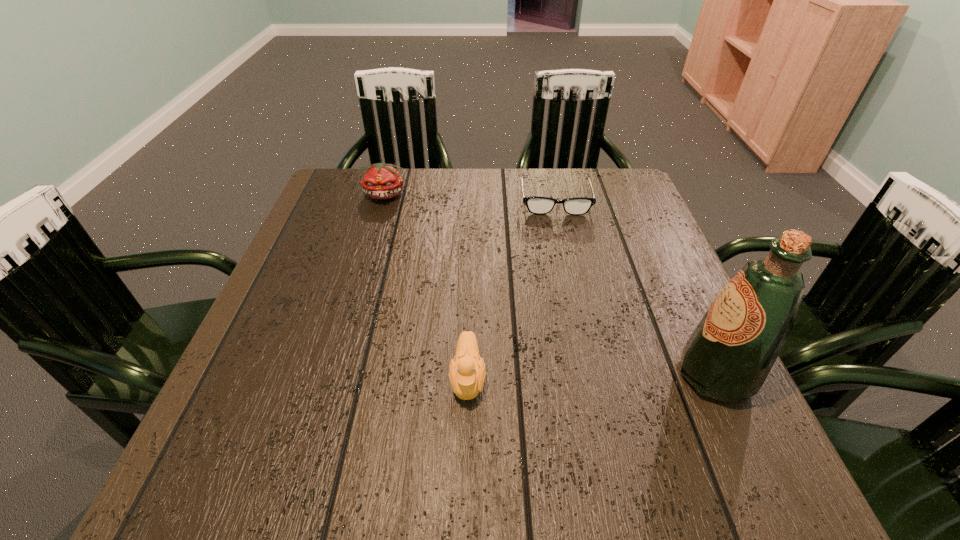
The width and height of the screenshot is (960, 540). I want to click on duckling, so click(x=467, y=374).

Find the location of a particular element. This screenshot has width=960, height=540. olive oil is located at coordinates (728, 357).

This screenshot has height=540, width=960. Find the location of `the tallest object`. the tallest object is located at coordinates (728, 357).

Locate an element on the screen. spectacles is located at coordinates (538, 205).

At what (x,y) coordinates should I click in order to perform the action: click on the shortest object. Please return your answer as a coordinate pair (x, y). The height and width of the screenshot is (540, 960). Looking at the image, I should click on (538, 205).

You are a GUI agent. You are given a task and a screenshot of the screen. Output one action in this format:
    pyautogui.click(x=<x>, y=<y>)
    Task: Click on the tomato
    
    Given the screenshot: What is the action you would take?
    pyautogui.click(x=381, y=181)

In order to click on blank space located 0.050m on the front-facing side of the rightmost object in this screenshot , I will do `click(651, 376)`.

Where is `free location located 0.280m on the front-facing side of the rightmost object`? The image size is (960, 540). free location located 0.280m on the front-facing side of the rightmost object is located at coordinates (524, 376).

Find the location of a particular element. The width and height of the screenshot is (960, 540). free space located on the front-facing side of the rightmost object is located at coordinates (496, 376).

You are a GUI agent. You are given a task and a screenshot of the screen. Output one action in this format:
    pyautogui.click(x=<x>, y=<y>)
    Task: Click on the vacant region located on the front-facing side of the spectacles
    The image size is (960, 540).
    Given the screenshot: What is the action you would take?
    pyautogui.click(x=563, y=244)